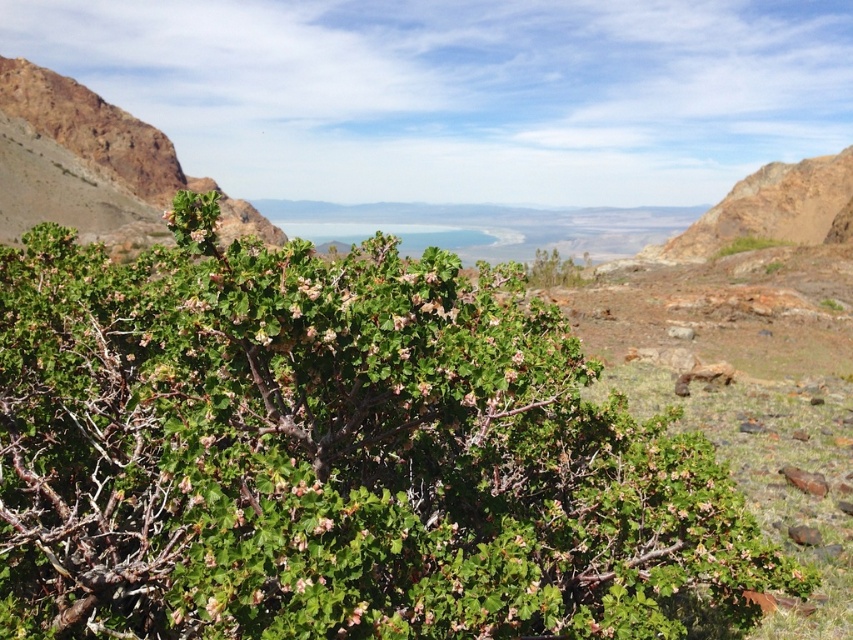
Question: Does green leafy bush at center have a smaller size compared to green leafy bush at upper left?

Choices:
 (A) yes
 (B) no

Answer: (A)

Question: Among these points, which one is farthest from the camera?

Choices:
 (A) (672, 449)
 (B) (74, 132)

Answer: (B)

Question: Is green leafy bush at center smaller than green leafy bush at upper left?

Choices:
 (A) no
 (B) yes

Answer: (B)

Question: From the image, what is the correct spatial relationship of green leafy bush at center in relation to green leafy bush at upper left?

Choices:
 (A) below
 (B) above

Answer: (A)

Question: Which object is farther from the camera taking this photo?

Choices:
 (A) green leafy bush at upper left
 (B) green leafy bush at center

Answer: (A)

Question: Which object is closer to the camera taking this photo?

Choices:
 (A) green leafy bush at upper left
 (B) green leafy bush at center

Answer: (B)